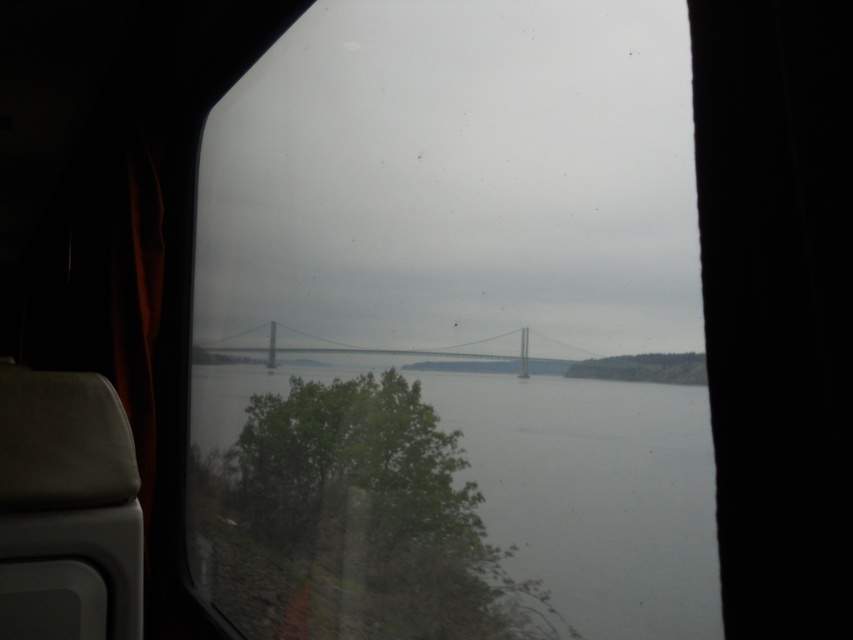
You are a passenger in the train and looking out the window. You see the gray water at center and the gray metallic bridge at center. Which one is more to the right side?

The gray water at center is positioned on the right side of the gray metallic bridge at center, so the gray water at center is more to the right side.

You are a passenger sitting in the train and want to take a photo of the gray metallic bridge at center through the transparent glass window at center. Can the entire bridge fit within the window frame?

The transparent glass window at center is wider than the gray metallic bridge at center, so the entire bridge can fit within the window frame.

You are a passenger sitting in the train and looking through the window. You see the gray water at center and the gray metallic bridge at center. Which one is closer to the window?

The gray water at center is closer to the window than the gray metallic bridge at center because the distance between them is 10.29 inches.